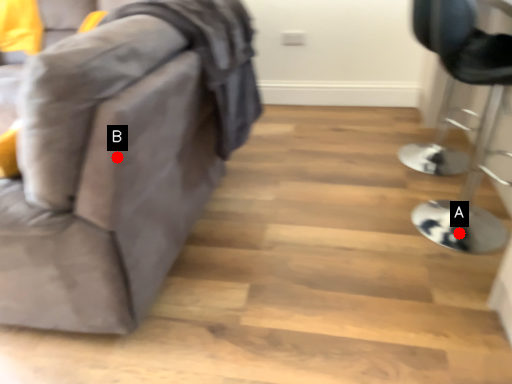
Question: Two points are circled on the image, labeled by A and B beside each circle. Which point appears closest to the camera in this image?

Choices:
 (A) A is closer
 (B) B is closer

Answer: (B)